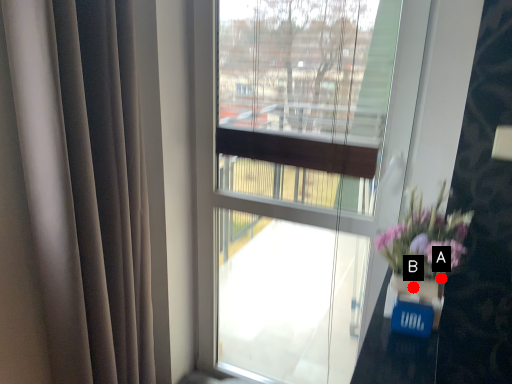
Question: Two points are circled on the image, labeled by A and B beside each circle. Which point is farther to the camera?

Choices:
 (A) A is further
 (B) B is further

Answer: (A)